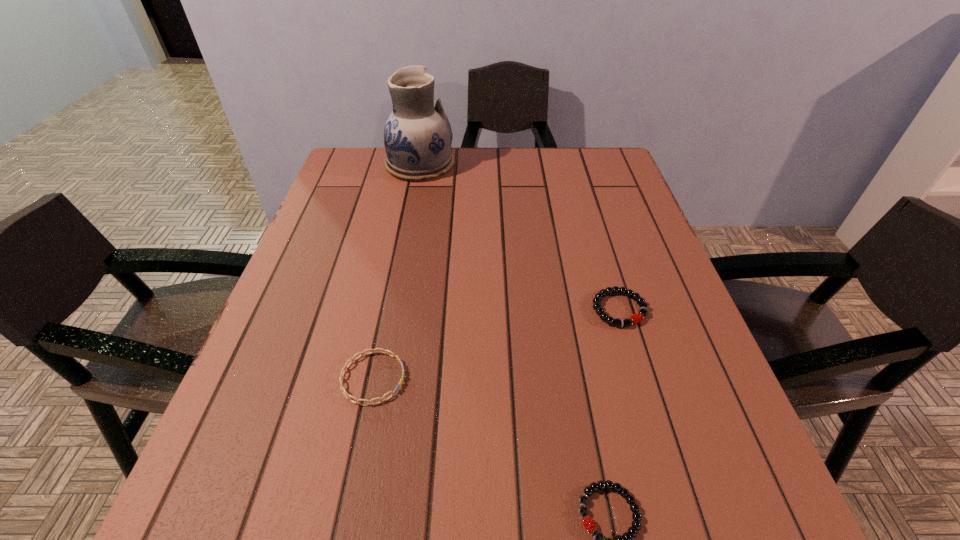
The height and width of the screenshot is (540, 960). I want to click on free point between the second farthest bracelet and the pottery, so click(x=396, y=272).

This screenshot has width=960, height=540. What are the coordinates of `free space between the tallest object and the rightmost bracelet` in the screenshot? It's located at (519, 237).

This screenshot has height=540, width=960. I want to click on unoccupied position between the second nearest object and the rightmost object, so click(496, 343).

Locate an element on the screen. The height and width of the screenshot is (540, 960). vacant point located between the pottery and the farthest bracelet is located at coordinates (519, 237).

Where is `object that is the nearest to the second bracelet from left to right`? object that is the nearest to the second bracelet from left to right is located at coordinates (636, 318).

I want to click on object that is the second closest to the pottery, so click(x=352, y=359).

Locate an element on the screen. This screenshot has width=960, height=540. the second closest bracelet to the second nearest bracelet is located at coordinates (636, 318).

This screenshot has height=540, width=960. I want to click on bracelet that is the second closest to the rightmost object, so click(352, 359).

In order to click on free space that satisfies the following two spatial constraints: 1. on the front side of the farthest object; 2. on the right side of the farthest bracelet in this screenshot , I will do `click(393, 309)`.

In order to click on free space that satisfies the following two spatial constraints: 1. on the front side of the farthest object; 2. on the right side of the second farthest object in this screenshot , I will do `click(393, 309)`.